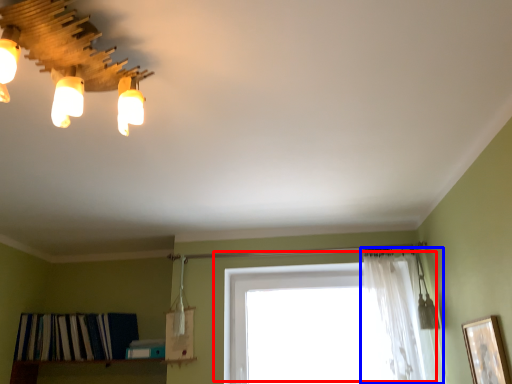
Question: Which point is further to the camera, window (highlighted by a red box) or curtain (highlighted by a blue box)?

Choices:
 (A) window
 (B) curtain

Answer: (A)